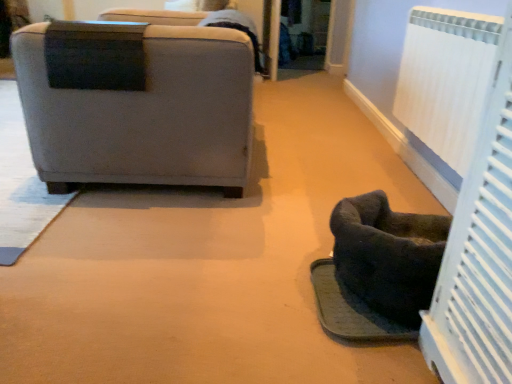
Question: From the image's perspective, relative to dark gray fabric footrest at lower right, is dark fabric pet bed at lower right above or below?

Choices:
 (A) above
 (B) below

Answer: (A)

Question: Considering the positions of dark fabric pet bed at lower right and dark gray fabric footrest at lower right in the image, is dark fabric pet bed at lower right bigger or smaller than dark gray fabric footrest at lower right?

Choices:
 (A) big
 (B) small

Answer: (A)

Question: Considering the real-world distances, which object is farthest from the dark fabric pet bed at lower right?

Choices:
 (A) gray fabric chair at left
 (B) dark gray fabric footrest at lower right
 (C) white textured radiator at right

Answer: (A)

Question: Which object is positioned farthest from the dark fabric pet bed at lower right?

Choices:
 (A) white textured radiator at right
 (B) dark gray fabric footrest at lower right
 (C) gray fabric chair at left

Answer: (C)